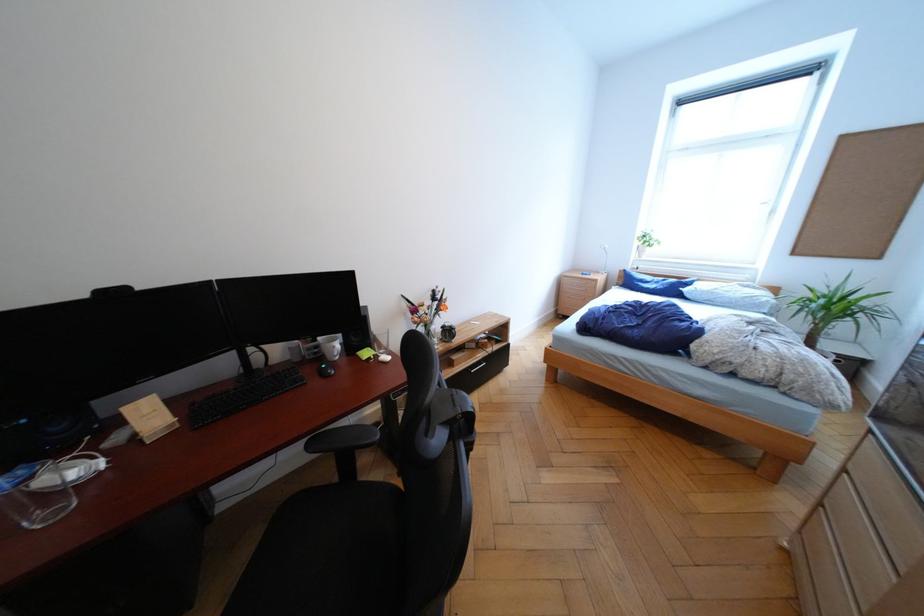
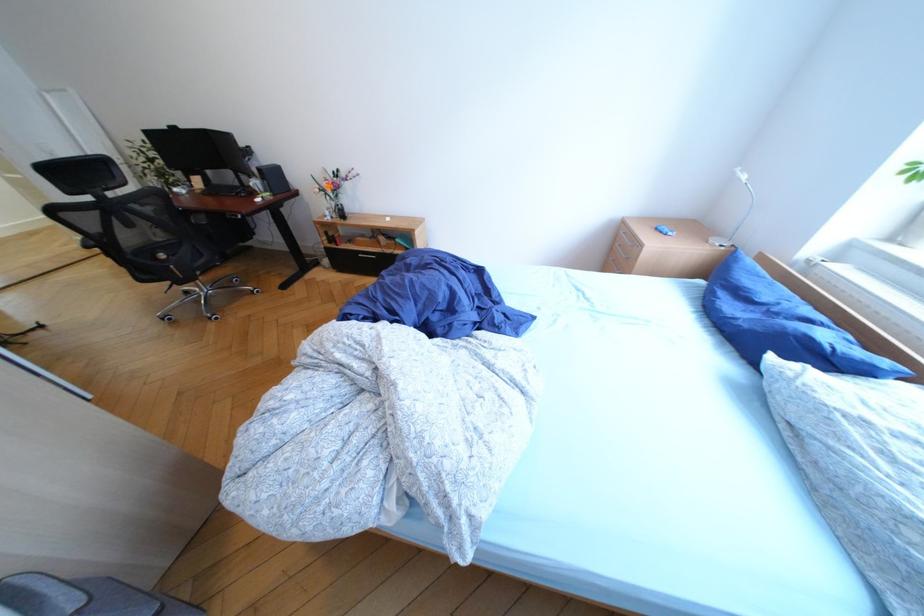
Where in the second image is the point corresponding to pixel 735 290 from the first image?

(912, 448)